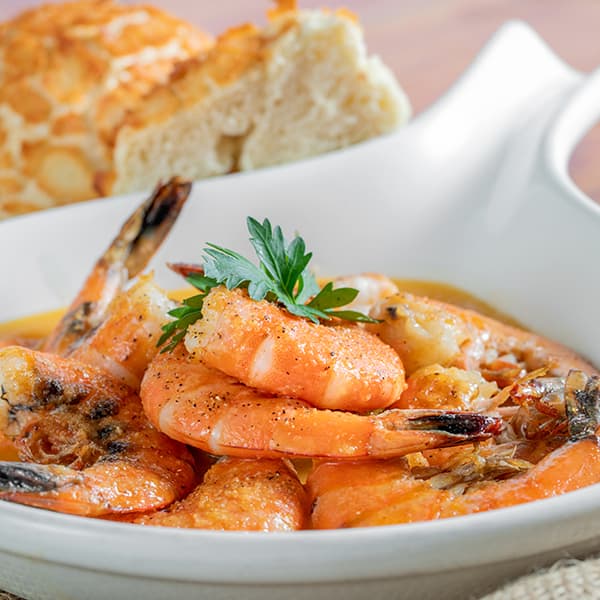
What are the coordinates of `table place fabric` in the screenshot? It's located at [x=573, y=590].